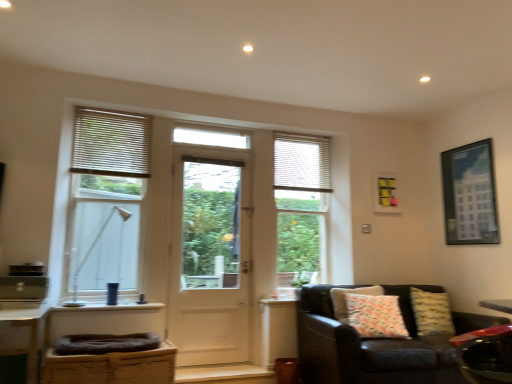
Question: From the image's perspective, relative to brown woven basket at lower left, marked as the 1th swivel chair in a back-to-front arrangement, is white matte blinds at upper left above or below?

Choices:
 (A) above
 (B) below

Answer: (A)

Question: Would you say white matte blinds at upper left is to the left or to the right of brown woven basket at lower left, the first swivel chair from the left, in the picture?

Choices:
 (A) left
 (B) right

Answer: (A)

Question: Which object is positioned closest to the metallic red swivel chair at lower right, acting as the second swivel chair starting from the back?

Choices:
 (A) leather couch at lower right
 (B) yellow textured pillow at lower right, the first pillow positioned from the right
 (C) white wooden door at center
 (D) patterned fabric pillow at lower right, which ranks as the 2th pillow in right-to-left order
 (E) wooden blinds at left, the third window positioned from the right

Answer: (B)

Question: Which of these objects is positioned farthest from the matte white window at center, which appears as the first window when viewed from the back?

Choices:
 (A) white matte shutter at upper right
 (B) yellow textured pillow at lower right, the first pillow positioned from the right
 (C) wooden blinds at left, the 1th window viewed from the left
 (D) white wooden door at center
 (E) white matte blinds at upper left

Answer: (C)